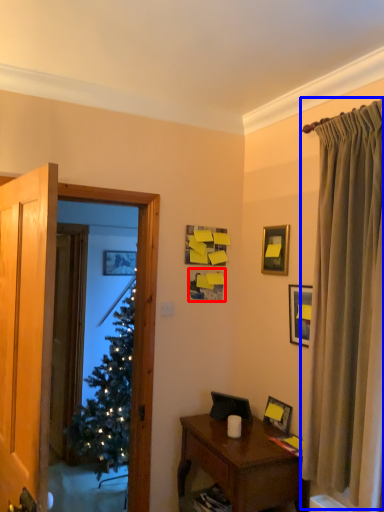
Question: Which point is closer to the camera, picture frame (highlighted by a red box) or curtain (highlighted by a blue box)?

Choices:
 (A) picture frame
 (B) curtain

Answer: (B)